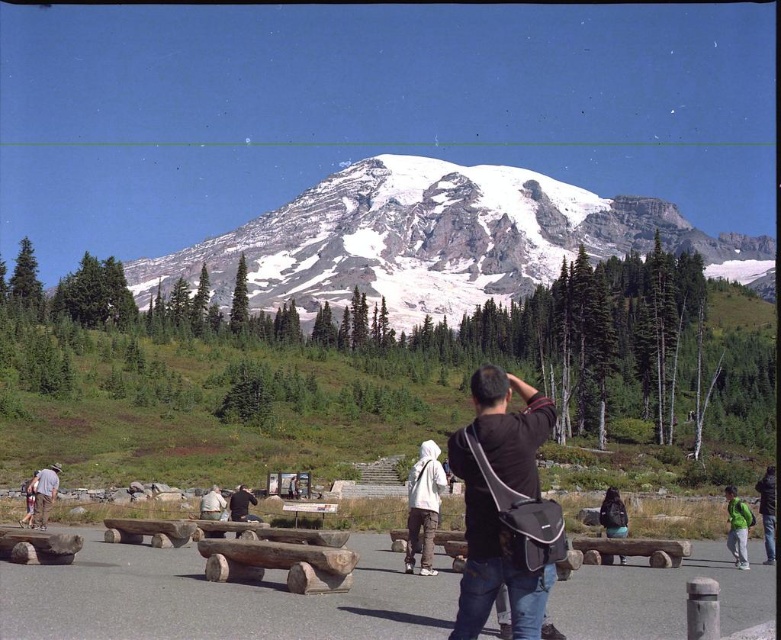
Can you confirm if snowy granite mountain at center is thinner than white fleece jacket at center?

In fact, snowy granite mountain at center might be wider than white fleece jacket at center.

Between snowy granite mountain at center and white fleece jacket at center, which one has less height?

white fleece jacket at center

Is point (293, 198) behind point (412, 502)?

Yes, point (293, 198) is behind point (412, 502).

What are the coordinates of `snowy granite mountain at center` in the screenshot? It's located at (437, 241).

Which of these two, green fabric backpack at lower right or denim jacket at lower left, stands shorter?

Standing shorter between the two is denim jacket at lower left.

Can you confirm if green fabric backpack at lower right is thinner than denim jacket at lower left?

No.

Looking at this image, who is more forward, [762,502] or [25,497]?

Point [762,502] is in front.

What are the coordinates of `green fabric backpack at lower right` in the screenshot? It's located at pos(767,512).

Who is taller, snowy granite mountain at center or black fabric bag at center?

snowy granite mountain at center is taller.

The height and width of the screenshot is (640, 781). What are the coordinates of `snowy granite mountain at center` in the screenshot? It's located at (437, 241).

Is point (644, 234) less distant than point (494, 433)?

No, it is not.

Identify the location of snowy granite mountain at center. Image resolution: width=781 pixels, height=640 pixels. (437, 241).